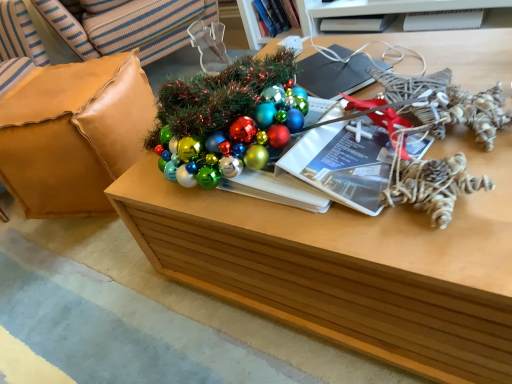
Where is `spots to the right of black matte magazine at upper center, placed as the second magazine when sorted from bottom to top`? This screenshot has width=512, height=384. spots to the right of black matte magazine at upper center, placed as the second magazine when sorted from bottom to top is located at coordinates (404, 50).